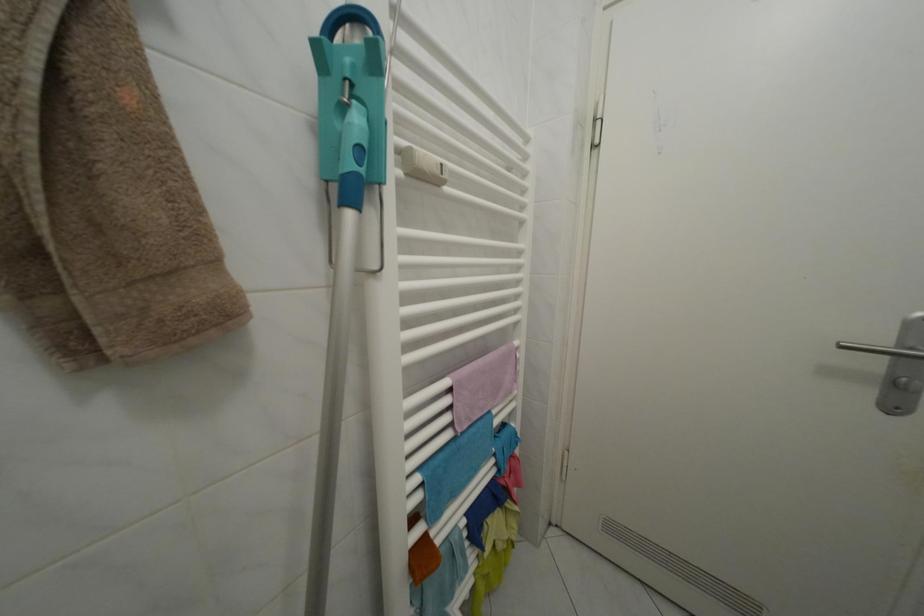
What do you see at coordinates (332, 406) in the screenshot? I see `the mop handle` at bounding box center [332, 406].